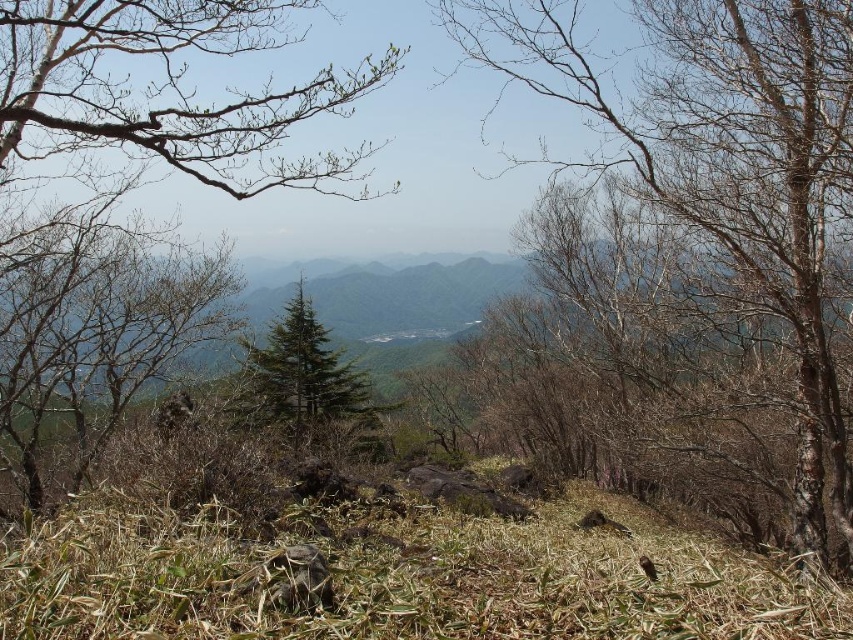
Question: Which point appears farthest from the camera in this image?

Choices:
 (A) (78, 387)
 (B) (71, 344)
 (C) (138, 602)

Answer: (A)

Question: Which is nearer to the green textured tree at center?

Choices:
 (A) bare bark tree at center
 (B) bare branches at upper left
 (C) bare branches at left

Answer: (B)

Question: Does bare branches at upper left have a lesser width compared to green textured tree at center?

Choices:
 (A) no
 (B) yes

Answer: (A)

Question: Is bare branches at upper left smaller than green leafy branch at upper left?

Choices:
 (A) yes
 (B) no

Answer: (B)

Question: Which point is closer to the camera?

Choices:
 (A) (490, 26)
 (B) (299, 285)
 (C) (242, 195)

Answer: (A)

Question: Can you confirm if green leafy branch at upper left is wider than green textured tree at center?

Choices:
 (A) no
 (B) yes

Answer: (A)